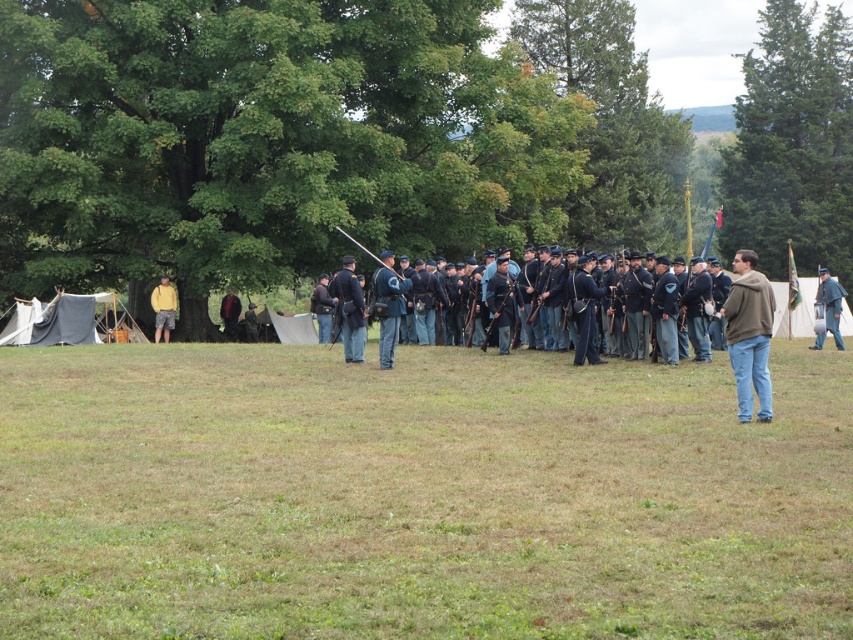
Which is more to the left, blue wool uniform at center or dark brown leather jacket at center?

Positioned to the left is dark brown leather jacket at center.

Which is more to the right, blue wool uniform at center or dark brown leather jacket at center?

blue wool uniform at center

Who is more distant from viewer, (821, 268) or (224, 300)?

The point (224, 300) is more distant.

At what (x,y) coordinates should I click in order to perform the action: click on blue wool uniform at center. Please return your answer as a coordinate pair (x, y). The height and width of the screenshot is (640, 853). Looking at the image, I should click on (830, 304).

Is dark blue uniform at center closer to camera compared to blue wool uniform at center?

Yes, dark blue uniform at center is in front of blue wool uniform at center.

In the scene shown: Between dark blue uniform at center and blue wool uniform at center, which one appears on the right side from the viewer's perspective?

From the viewer's perspective, blue wool uniform at center appears more on the right side.

Is point (363, 321) in front of point (840, 346)?

Yes, it is.

In order to click on dark blue uniform at center in this screenshot , I will do `click(349, 308)`.

What do you see at coordinates (163, 308) in the screenshot? This screenshot has height=640, width=853. I see `yellow cotton shirt at left` at bounding box center [163, 308].

Does point (160, 284) come farther from viewer compared to point (231, 301)?

No, it is in front of (231, 301).

At what (x,y) coordinates should I click in order to perform the action: click on yellow cotton shirt at left. Please return your answer as a coordinate pair (x, y). The width and height of the screenshot is (853, 640). Looking at the image, I should click on (163, 308).